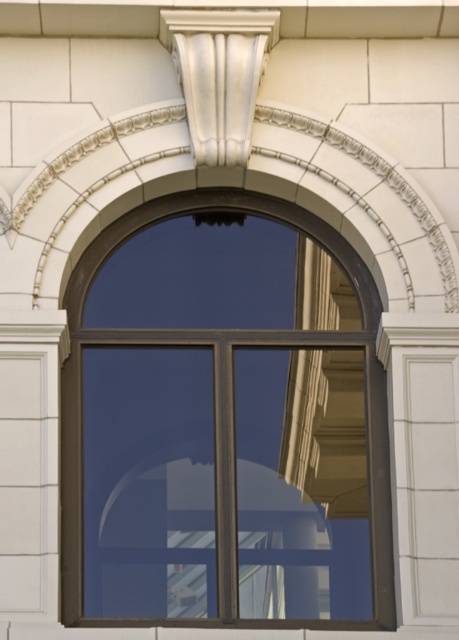
Who is higher up, matte black window frame at center or glossy glass window at center?

matte black window frame at center is higher up.

Does point (335, 449) come behind point (117, 492)?

Yes, it is behind point (117, 492).

Does point (275, 561) come behind point (302, 576)?

Yes, point (275, 561) is behind point (302, 576).

Locate an element on the screen. This screenshot has height=640, width=459. matte black window frame at center is located at coordinates (223, 420).

Is point (116, 436) farther from camera compared to point (175, 28)?

No, (116, 436) is in front of (175, 28).

Can you confirm if matte black window frame at center is positioned below white glossy column at upper center?

Correct, matte black window frame at center is located below white glossy column at upper center.

Who is more distant from viewer, (x=201, y=250) or (x=251, y=97)?

Answer: The point (x=201, y=250) is more distant.

This screenshot has height=640, width=459. Identify the location of matte black window frame at center. (223, 420).

This screenshot has width=459, height=640. What do you see at coordinates (160, 540) in the screenshot?
I see `glossy glass window at center` at bounding box center [160, 540].

Between glossy glass window at center and white glossy column at upper center, which one has less height?

glossy glass window at center

Identify the location of glossy glass window at center. (160, 540).